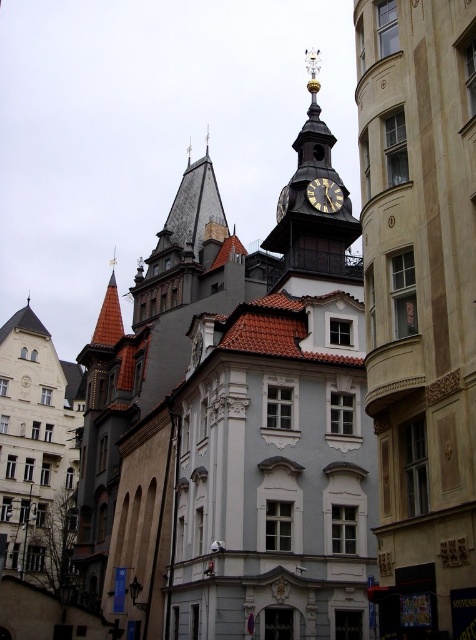
Question: Can you confirm if gold metallic clock tower at upper center is wider than gold metallic clock at upper center?

Choices:
 (A) no
 (B) yes

Answer: (B)

Question: Can you confirm if gold metallic clock tower at upper center is positioned to the left of gold-toned metal clock at center?

Choices:
 (A) yes
 (B) no

Answer: (B)

Question: Which point is farther to the camera?

Choices:
 (A) gold metallic clock at upper center
 (B) gold-toned metal clock at center
 (C) gold metallic clock tower at upper center

Answer: (B)

Question: Does gold-toned metal clock at center appear over gold metallic clock at upper center?

Choices:
 (A) yes
 (B) no

Answer: (B)

Question: Which object is farther from the camera taking this photo?

Choices:
 (A) gold-toned metal clock at center
 (B) gold metallic clock tower at upper center
 (C) gold metallic clock at upper center

Answer: (A)

Question: Considering the real-world distances, which object is closest to the gold-toned metal clock at center?

Choices:
 (A) gold metallic clock tower at upper center
 (B) gold metallic clock at upper center

Answer: (B)